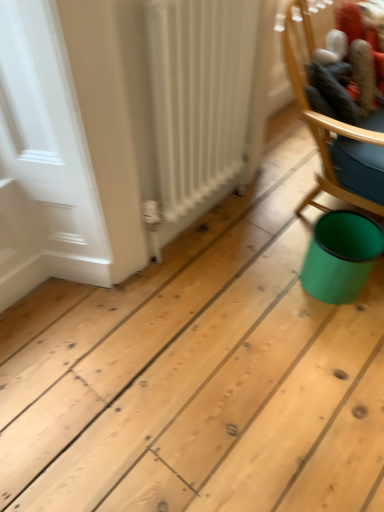
Question: Is teal plastic can at lower right turned away from white matte radiator at left?

Choices:
 (A) yes
 (B) no

Answer: (A)

Question: Does teal plastic can at lower right appear on the left side of white matte radiator at left?

Choices:
 (A) yes
 (B) no

Answer: (B)

Question: From a real-world perspective, is teal plastic can at lower right on top of white matte radiator at left?

Choices:
 (A) yes
 (B) no

Answer: (B)

Question: From the image's perspective, is teal plastic can at lower right on white matte radiator at left?

Choices:
 (A) yes
 (B) no

Answer: (B)

Question: Would you say white matte radiator at left is part of teal plastic can at lower right's contents?

Choices:
 (A) yes
 (B) no

Answer: (B)

Question: Considering the positions of teal plastic can at lower right and white matte radiator at left in the image, is teal plastic can at lower right taller or shorter than white matte radiator at left?

Choices:
 (A) tall
 (B) short

Answer: (B)

Question: From the image's perspective, is teal plastic can at lower right above or below white matte radiator at left?

Choices:
 (A) above
 (B) below

Answer: (B)

Question: Based on their sizes in the image, would you say teal plastic can at lower right is bigger or smaller than white matte radiator at left?

Choices:
 (A) big
 (B) small

Answer: (B)

Question: Which is correct: teal plastic can at lower right is inside white matte radiator at left, or outside of it?

Choices:
 (A) outside
 (B) inside

Answer: (A)

Question: Considering their positions, is teal plastic can at lower right located in front of or behind wooden chair at upper right?

Choices:
 (A) behind
 (B) front

Answer: (A)

Question: In terms of width, does teal plastic can at lower right look wider or thinner when compared to wooden chair at upper right?

Choices:
 (A) thin
 (B) wide

Answer: (B)

Question: From a real-world perspective, is teal plastic can at lower right above or below wooden chair at upper right?

Choices:
 (A) above
 (B) below

Answer: (B)

Question: Is point (314, 252) closer or farther from the camera than point (304, 87)?

Choices:
 (A) closer
 (B) farther

Answer: (A)

Question: Based on their sizes in the image, would you say wooden chair at upper right is bigger or smaller than teal plastic can at lower right?

Choices:
 (A) small
 (B) big

Answer: (B)

Question: From the image's perspective, is wooden chair at upper right above or below teal plastic can at lower right?

Choices:
 (A) below
 (B) above

Answer: (B)